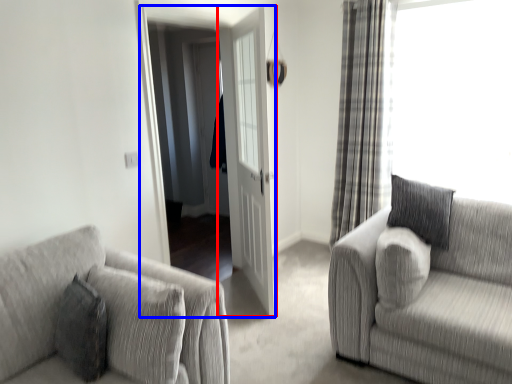
Question: Among these objects, which one is farthest to the camera, door (highlighted by a red box) or screen door (highlighted by a blue box)?

Choices:
 (A) door
 (B) screen door

Answer: (B)